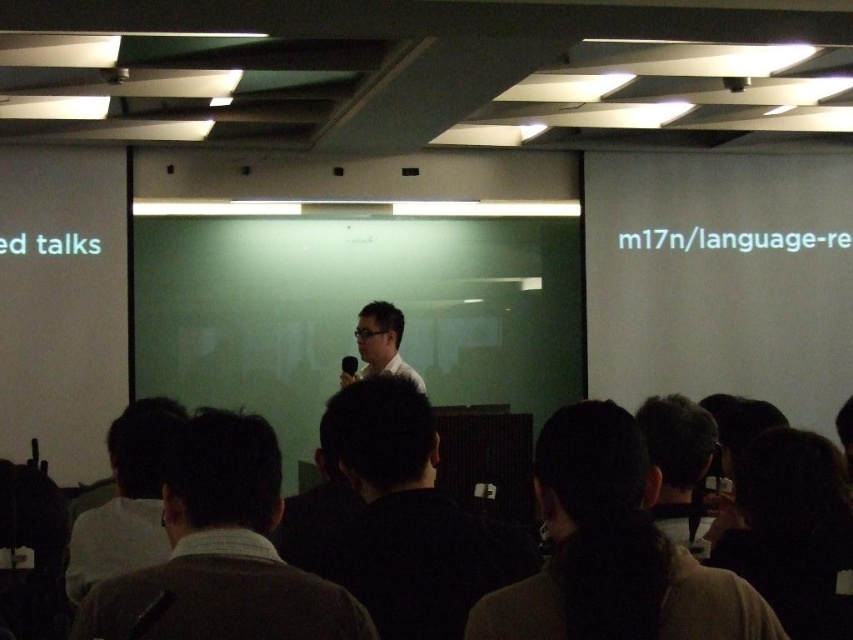
Between dark hair at center and matte black hair at center, which one is positioned higher?

dark hair at center is above.

What do you see at coordinates (612, 550) in the screenshot? This screenshot has width=853, height=640. I see `dark hair at center` at bounding box center [612, 550].

Who is more forward, (544, 506) or (657, 445)?

Point (544, 506) is in front.

Locate an element on the screen. dark hair at center is located at coordinates (612, 550).

Who is positioned more to the right, black fabric at lower right or matte black hair at center?

black fabric at lower right

Can you confirm if black fabric at lower right is taller than matte black hair at center?

Yes, black fabric at lower right is taller than matte black hair at center.

Locate an element on the screen. The height and width of the screenshot is (640, 853). black fabric at lower right is located at coordinates (788, 528).

I want to click on black fabric at lower right, so click(788, 528).

Which of these two, dark brown hair at center or matte white shirt at center, stands shorter?

dark brown hair at center

Is dark brown hair at center wider than matte white shirt at center?

Indeed, dark brown hair at center has a greater width compared to matte white shirt at center.

Find the location of a particular element. dark brown hair at center is located at coordinates (222, 550).